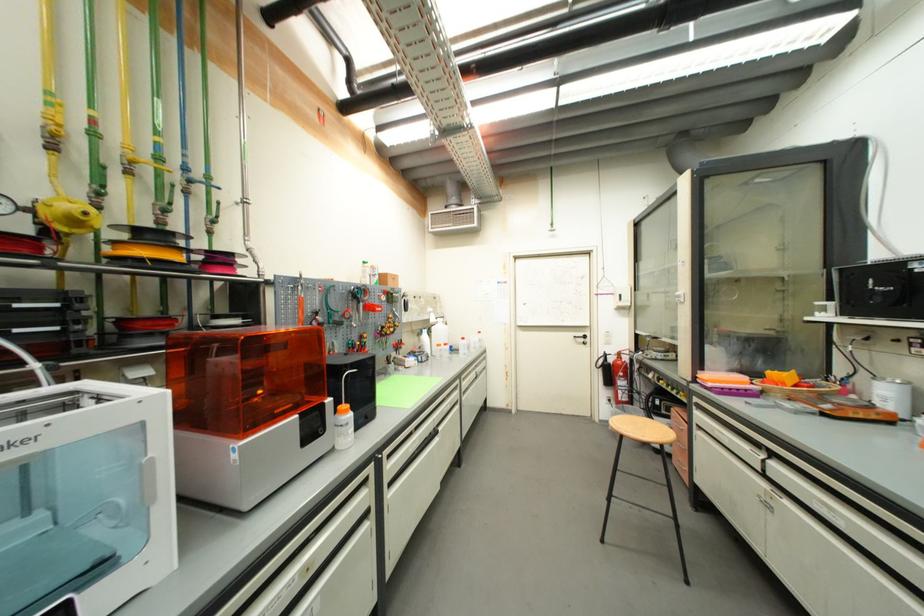
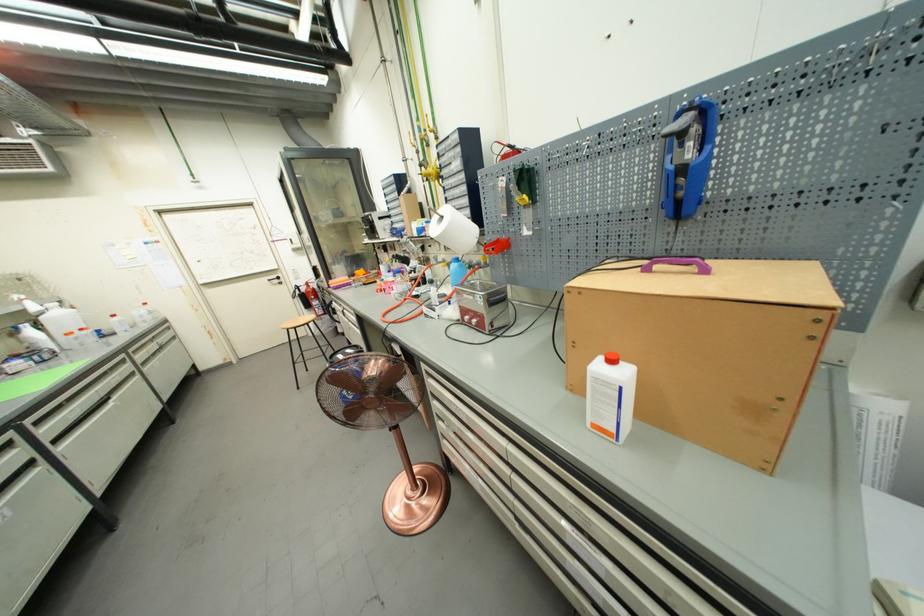
The point at (580, 339) is marked in the first image. Where is the corresponding point in the second image?

(274, 282)